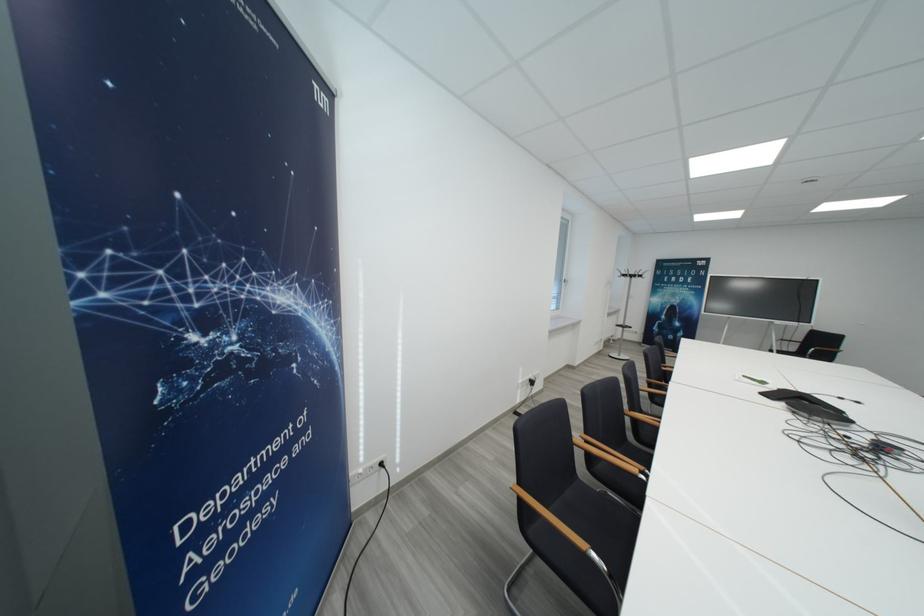
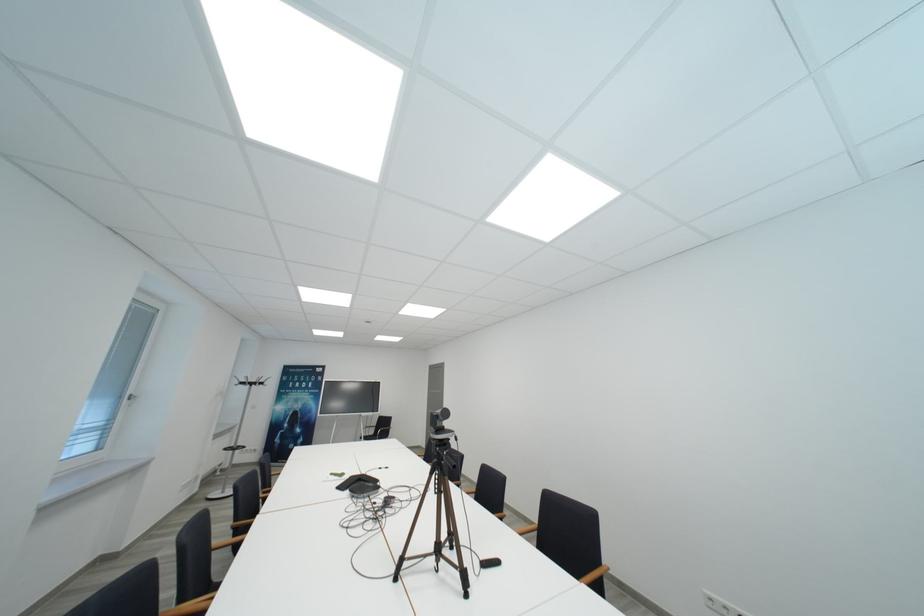
First-person continuous shooting, in which direction is the camera rotating?

The rotation direction of the camera is right-up.